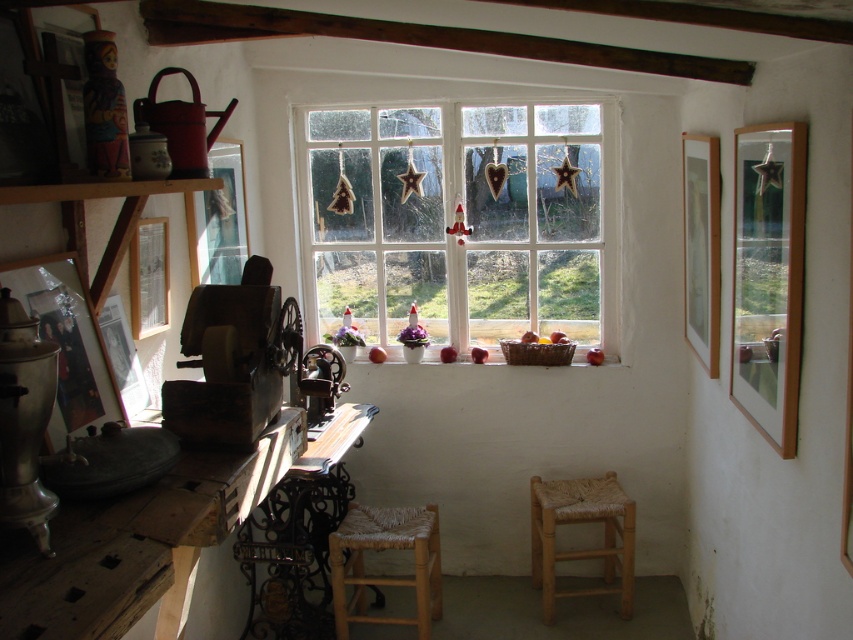
Based on the photo, you are standing in the center of the room and want to look out through the white wooden window at center. In which direction should you turn your head to face the window?

Since the white wooden window at center is located at point coordinates, you should turn your head towards the center of the room to face it directly.

You are standing in the room and want to place a decorative item on the closest wooden object. Which object should you choose between the wooden at left and the wooden woven stool at center?

The wooden at left is closer to the viewer than the wooden woven stool at center, so you should place the decorative item on the wooden at left.